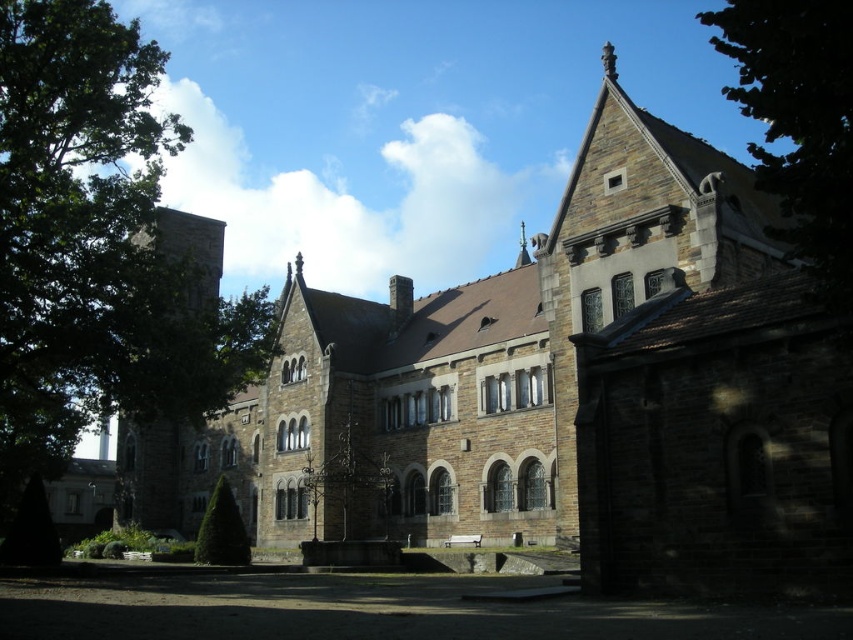
Question: Estimate the real-world distances between objects in this image. Which object is closer to the green leafy tree at upper right?

Choices:
 (A) green leafy tree at center
 (B) green leafy tree at left

Answer: (B)

Question: Is green leafy tree at left to the right of green leafy tree at upper right from the viewer's perspective?

Choices:
 (A) yes
 (B) no

Answer: (B)

Question: Does brown stone church at center have a smaller size compared to green leafy tree at upper right?

Choices:
 (A) yes
 (B) no

Answer: (A)

Question: Which point appears closest to the camera in this image?

Choices:
 (A) (674, 378)
 (B) (231, 552)
 (C) (827, 93)

Answer: (C)

Question: Among these points, which one is nearest to the camera?

Choices:
 (A) (167, 412)
 (B) (766, 54)

Answer: (B)

Question: Does green leafy tree at left appear under green leafy tree at upper right?

Choices:
 (A) yes
 (B) no

Answer: (A)